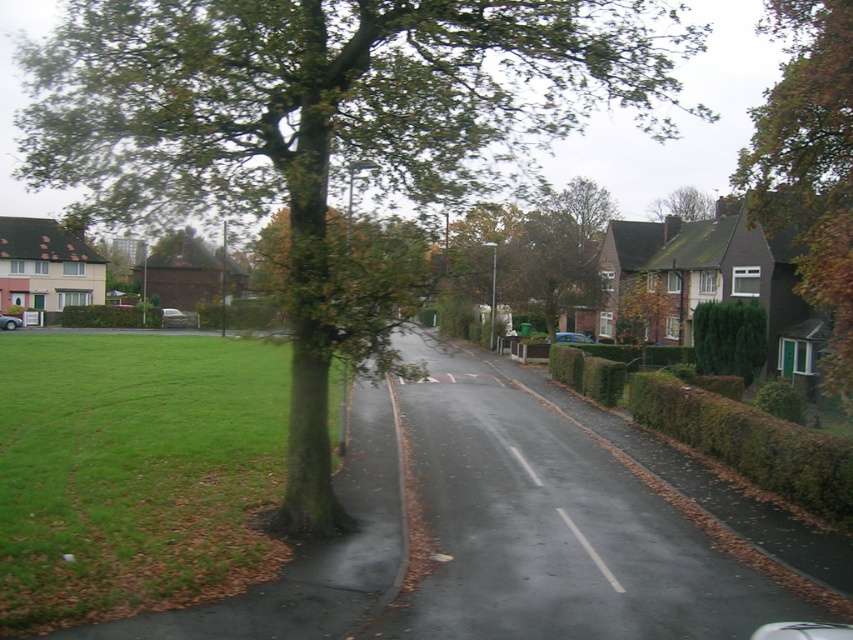
You are a delivery person trying to park your blue metallic car at center in the residential street. There is a green rough bark tree at center in the way. Can you park your car there without hitting the tree?

The green rough bark tree at center is bigger than the blue metallic car at center, so there might not be enough space to park the car without hitting the tree.

You are standing on the residential street and want to determine the relative positions of two points marked in the image. Which point, point (331, 60) or point (566, 336), is closer to you?

Point (331, 60) is closer to the viewer than point (566, 336).